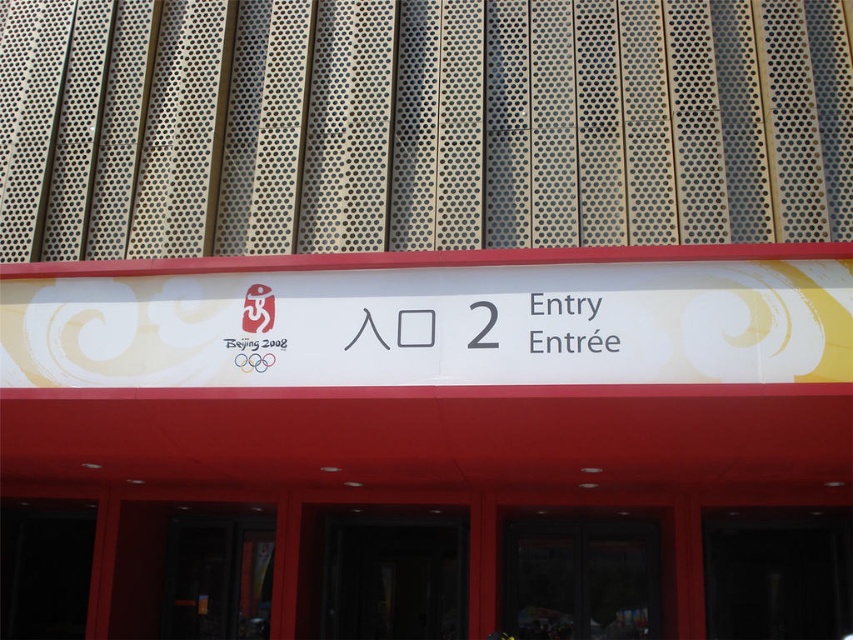
Question: Which object appears closest to the camera in this image?

Choices:
 (A) white plastic sign at center
 (B) black glass door at center

Answer: (A)

Question: Which of these objects is positioned farthest from the transparent glass door at center?

Choices:
 (A) dark glass door at center
 (B) white plastic sign at center
 (C) white paper at center

Answer: (C)

Question: Considering the real-world distances, which object is farthest from the dark glass door at center?

Choices:
 (A) white paper at center
 (B) black glass door at center
 (C) white plastic sign at center
 (D) transparent glass door at center

Answer: (C)

Question: Can you confirm if dark glass door at center is positioned below black glass door at center?

Choices:
 (A) yes
 (B) no

Answer: (A)

Question: Can you confirm if white plastic sign at center is positioned to the right of transparent glass door at center?

Choices:
 (A) yes
 (B) no

Answer: (B)

Question: Where is white plastic sign at center located in relation to black glass door at center in the image?

Choices:
 (A) above
 (B) below

Answer: (A)